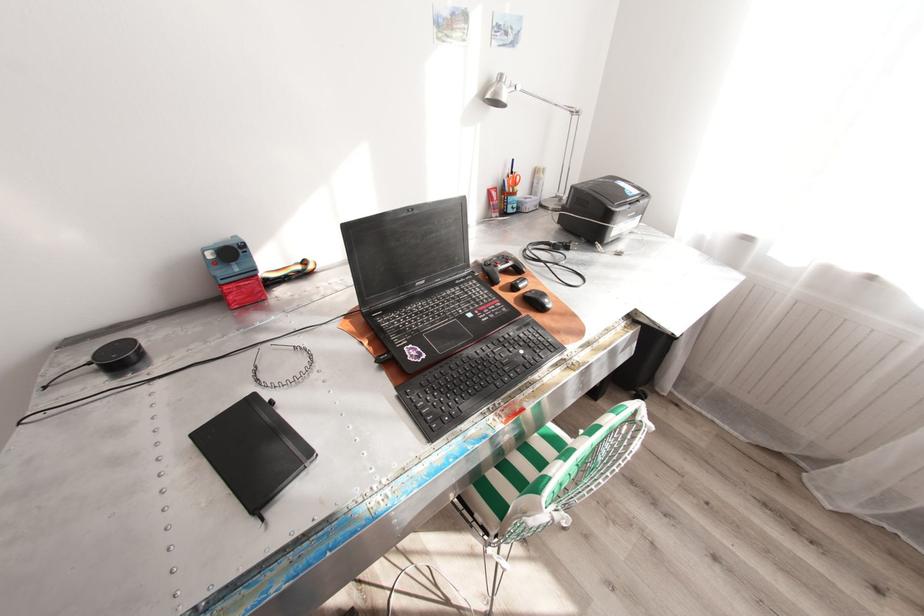
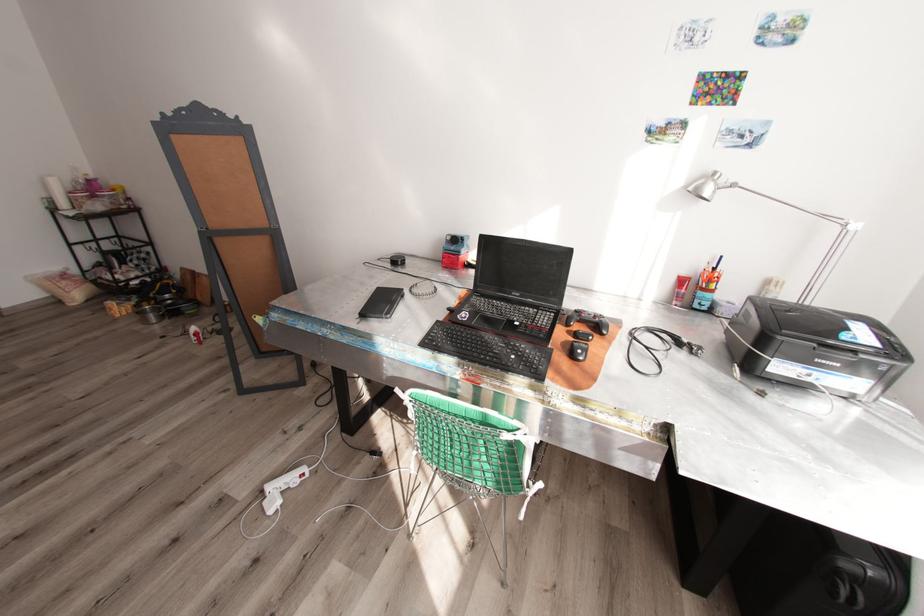
Where in the second image is the point corresponding to point (506, 339) from the first image?

(517, 344)